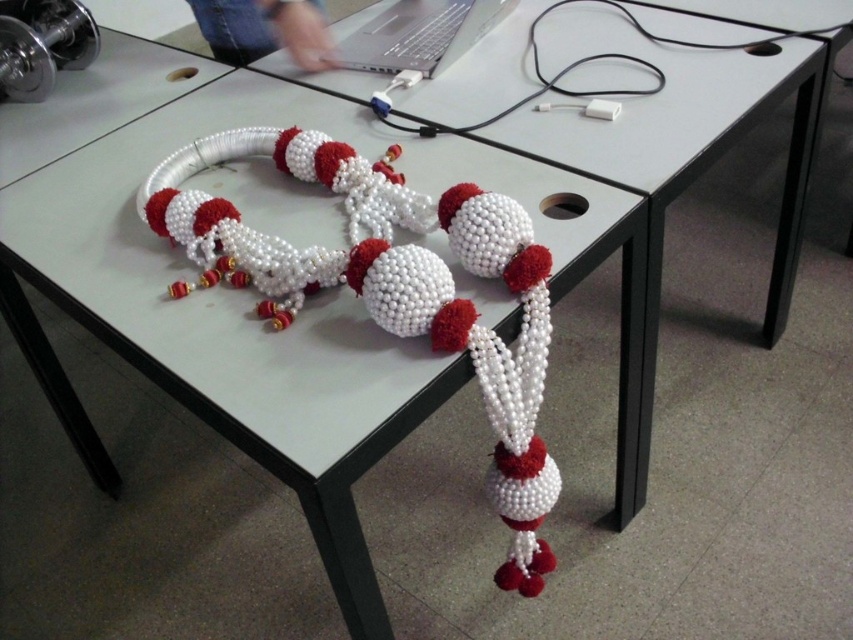
You are trying to reach the white matte cable at upper center to unplug it. There is a silver metallic laptop at upper center in the way. Can you easily access the cable without moving the laptop?

The silver metallic laptop at upper center is further to the viewer than the white matte cable at upper center, so the cable is closer to you. This means you can easily access the white matte cable at upper center without moving the laptop.

You are a delivery robot that needs to place a small package on the table. The package is 10 inches long. Can you fit it between the silver metallic laptop at upper center and the white matte cable at upper center without moving either object?

The silver metallic laptop at upper center and the white matte cable at upper center are 8.52 inches apart. Since the package is 10 inches long, which is longer than the available space, it cannot be placed between them without moving either object.